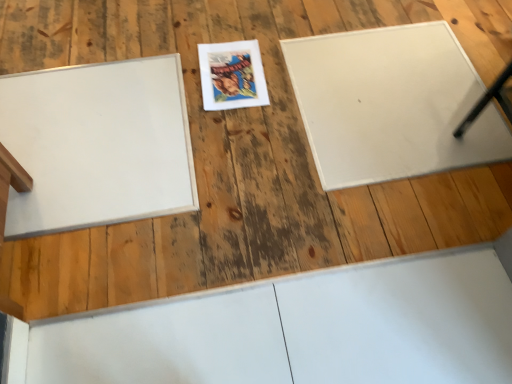
You are a GUI agent. You are given a task and a screenshot of the screen. Output one action in this format:
    pyautogui.click(x=<x>, y=<y>)
    Task: Click on the blank space to the left of matte paper comic book at center
    This screenshot has height=384, width=512.
    Given the screenshot: What is the action you would take?
    pyautogui.click(x=165, y=79)